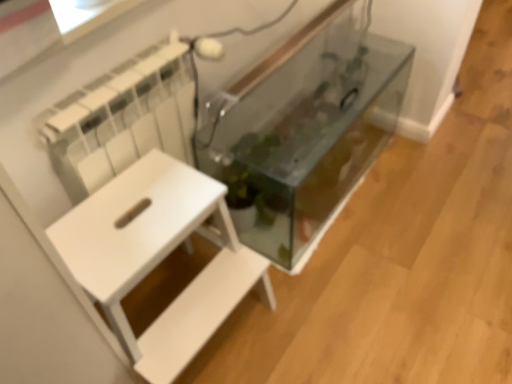
The height and width of the screenshot is (384, 512). Identify the location of empty space that is ontop of white matte side table at left. (147, 215).